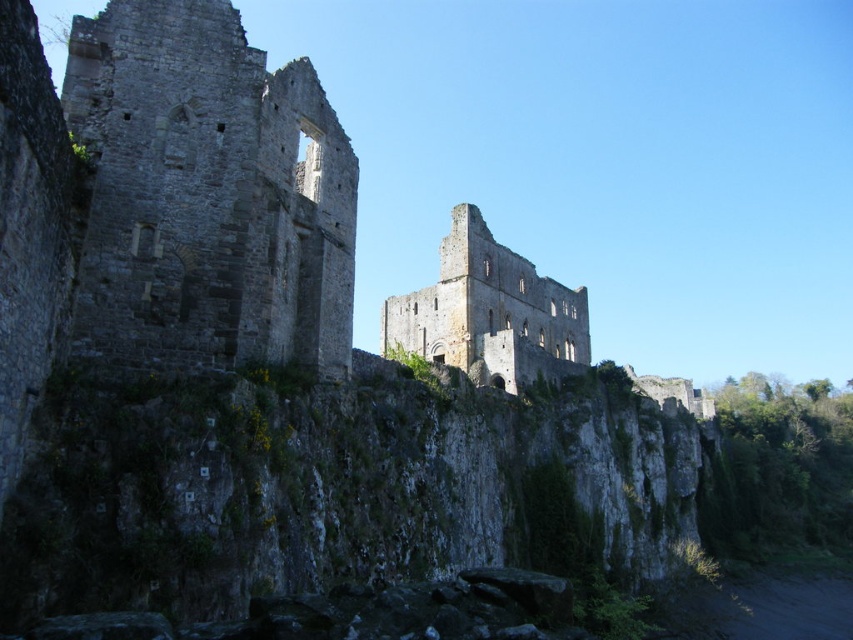
You are a historian examining the medieval ruins. You notice a specific point marked at coordinates (207, 193). What object is located at this point?

The gray stone ruins at center are located at point (207, 193).

You are an archaeologist examining the medieval ruins. You notice two distinct sections of stone ruins at the center of the image. Which of the two, the gray stone ruins at center or the rustic stone ruins at center, is narrower in width?

The gray stone ruins at center has a lesser width compared to rustic stone ruins at center, so the gray stone ruins at center is narrower.